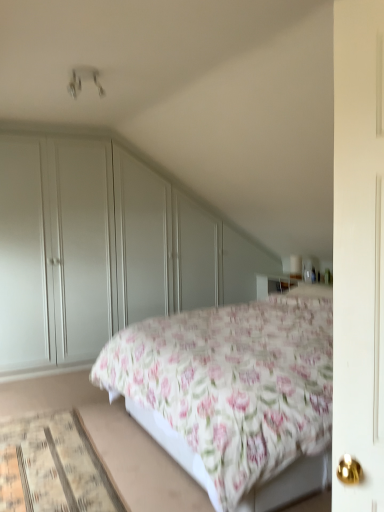
Question: From the image's perspective, is floral cotton bed at center located above or below matte white wardrobe at left?

Choices:
 (A) above
 (B) below

Answer: (B)

Question: Looking at the image, does floral cotton bed at center seem bigger or smaller compared to matte white wardrobe at left?

Choices:
 (A) small
 (B) big

Answer: (B)

Question: Estimate the real-world distances between objects in this image. Which object is closer to the floral cotton bed at center?

Choices:
 (A) matte white wardrobe at left
 (B) beige woven mat at lower left

Answer: (B)

Question: Which of these objects is positioned farthest from the floral cotton bed at center?

Choices:
 (A) beige woven mat at lower left
 (B) matte white wardrobe at left

Answer: (B)